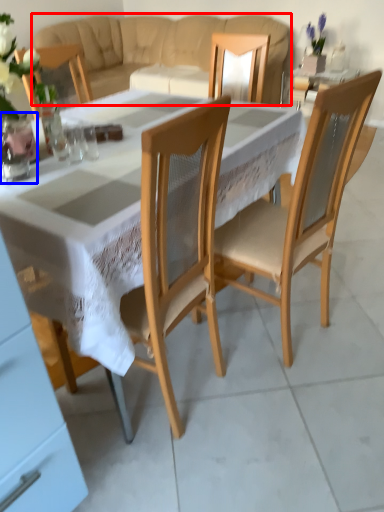
Question: Which object is further to the camera taking this photo, studio couch (highlighted by a red box) or vase (highlighted by a blue box)?

Choices:
 (A) studio couch
 (B) vase

Answer: (A)